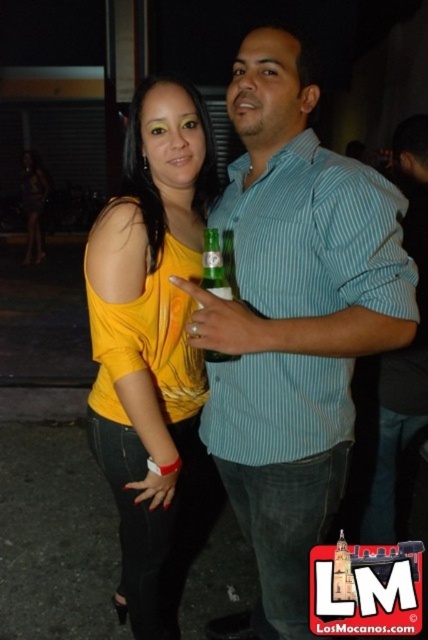
Is point (363, 337) closer to camera compared to point (231, 291)?

Yes, it is.

Can you confirm if matte blue shirt at center is taller than green glass bottle at center?

Indeed, matte blue shirt at center has a greater height compared to green glass bottle at center.

Where is `matte blue shirt at center`? The image size is (428, 640). matte blue shirt at center is located at coordinates (293, 323).

You are a GUI agent. You are given a task and a screenshot of the screen. Output one action in this format:
    pyautogui.click(x=<x>, y=<y>)
    Task: Click on the matte blue shirt at center
    The image size is (428, 640).
    Given the screenshot: What is the action you would take?
    pyautogui.click(x=293, y=323)

Which is in front, point (205, 243) or point (44, 253)?

Positioned in front is point (205, 243).

Can you confirm if green glass bottle at center is thinner than yellow matte tank top at center?

Correct, green glass bottle at center's width is less than yellow matte tank top at center's.

Between point (228, 250) and point (24, 202), which one is positioned in front?

Point (228, 250) is more forward.

Where is `green glass bottle at center`? Image resolution: width=428 pixels, height=640 pixels. green glass bottle at center is located at coordinates (217, 264).

Between matte yellow tank top at center and yellow matte tank top at center, which one is positioned lower?

matte yellow tank top at center is lower down.

Between matte yellow tank top at center and yellow matte tank top at center, which one has less height?

matte yellow tank top at center is shorter.

Does point (166, 577) come closer to viewer compared to point (32, 253)?

Yes.

At what (x,y) coordinates should I click in order to perform the action: click on matte yellow tank top at center. Please return your answer as a coordinate pair (x, y). Looking at the image, I should click on point(151,348).